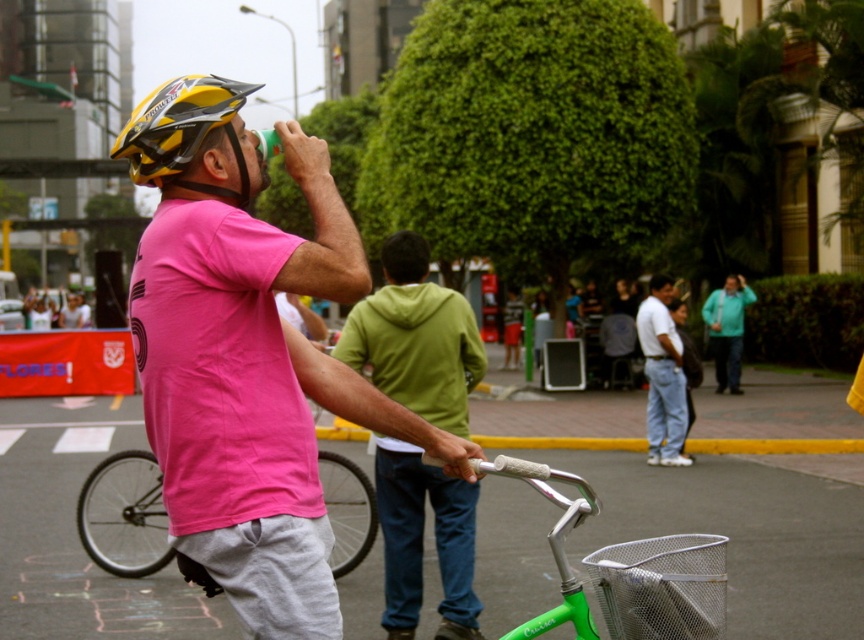
Question: Where is green matte bicycle at center located in relation to white cotton shirt at center in the image?

Choices:
 (A) above
 (B) below

Answer: (B)

Question: Which object is closer to the camera taking this photo?

Choices:
 (A) yellow matte bicycle helmet at upper left
 (B) pink matte shirt at center
 (C) teal fabric shirt at center

Answer: (B)

Question: Which object is farther from the camera taking this photo?

Choices:
 (A) white cotton shirt at center
 (B) green matte hoodie at center
 (C) yellow matte bicycle helmet at upper left
 (D) pink matte shirt at center

Answer: (A)

Question: Which point appears closest to the camera in this image?

Choices:
 (A) (411, 360)
 (B) (742, 307)

Answer: (A)

Question: Does yellow matte bicycle helmet at upper left appear over teal fabric shirt at center?

Choices:
 (A) yes
 (B) no

Answer: (A)

Question: Does pink matte shirt at center appear on the right side of teal fabric shirt at center?

Choices:
 (A) no
 (B) yes

Answer: (A)